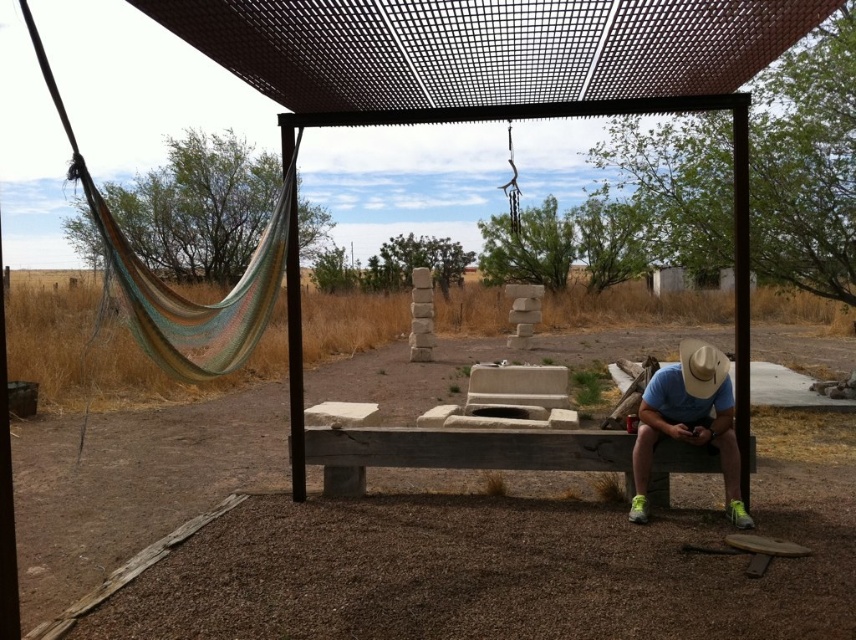
You are a photographer trying to capture a portrait of the person under the metal pergola. The blue cotton shirt at lower right and the white felt cowboy hat at right are both visible in your frame. Which clothing item appears larger in the photo?

The blue cotton shirt at lower right appears larger in the photo because it is much taller than the white felt cowboy hat at right.

In the scene shown: You are designing a new clothing rack that needs to accommodate both the blue cotton shirt at lower right and the white felt cowboy hat at right. If the rack has a shelf with a width of 1 meter, will both items fit side by side without overlapping?

The blue cotton shirt at lower right is wider than the white felt cowboy hat at right. Since the total width of both items combined would exceed 1 meter, they cannot fit side by side on the shelf without overlapping.

You are standing on the gravel ground under the metal pergola and see the blue cotton shirt at lower right and the white felt cowboy hat at right. Which object is closer to your left side?

The blue cotton shirt at lower right is positioned on the left side of white felt cowboy hat at right, so the blue cotton shirt at lower right is closer to your left side.